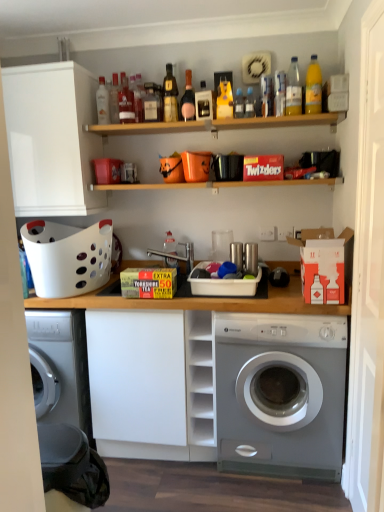
Identify the location of vacant area on top of cardboard box at center, which is the 2th cardboard box in right-to-left order (from a real-world perspective). This screenshot has width=384, height=512. (154, 266).